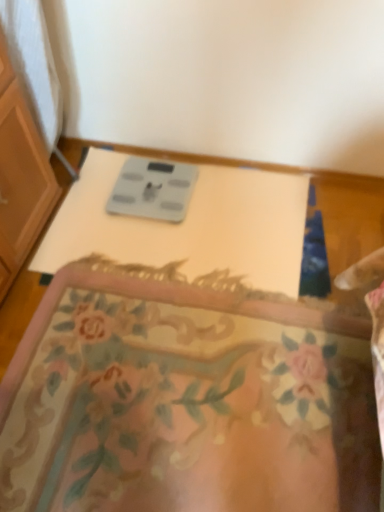
Question: Does floral carpet at center have a lesser height compared to gray plastic scale at center?

Choices:
 (A) no
 (B) yes

Answer: (B)

Question: Does floral carpet at center appear on the left side of gray plastic scale at center?

Choices:
 (A) yes
 (B) no

Answer: (B)

Question: Can you confirm if floral carpet at center is smaller than gray plastic scale at center?

Choices:
 (A) yes
 (B) no

Answer: (B)

Question: Is floral carpet at center located outside gray plastic scale at center?

Choices:
 (A) no
 (B) yes

Answer: (B)

Question: Is floral carpet at center positioned with its back to gray plastic scale at center?

Choices:
 (A) no
 (B) yes

Answer: (A)

Question: From the image's perspective, is floral carpet at center located beneath gray plastic scale at center?

Choices:
 (A) yes
 (B) no

Answer: (A)

Question: Can you confirm if gray plastic scale at center is taller than gray matte scale at center?

Choices:
 (A) yes
 (B) no

Answer: (A)

Question: Considering the relative sizes of gray plastic scale at center and gray matte scale at center in the image provided, is gray plastic scale at center smaller than gray matte scale at center?

Choices:
 (A) no
 (B) yes

Answer: (A)

Question: Is gray plastic scale at center aimed at gray matte scale at center?

Choices:
 (A) yes
 (B) no

Answer: (A)

Question: Is gray plastic scale at center located outside gray matte scale at center?

Choices:
 (A) no
 (B) yes

Answer: (B)

Question: Is gray plastic scale at center far away from gray matte scale at center?

Choices:
 (A) no
 (B) yes

Answer: (A)

Question: Considering the relative sizes of gray plastic scale at center and gray matte scale at center in the image provided, is gray plastic scale at center wider than gray matte scale at center?

Choices:
 (A) no
 (B) yes

Answer: (B)

Question: Is gray plastic scale at center in contact with floral carpet at center?

Choices:
 (A) no
 (B) yes

Answer: (A)